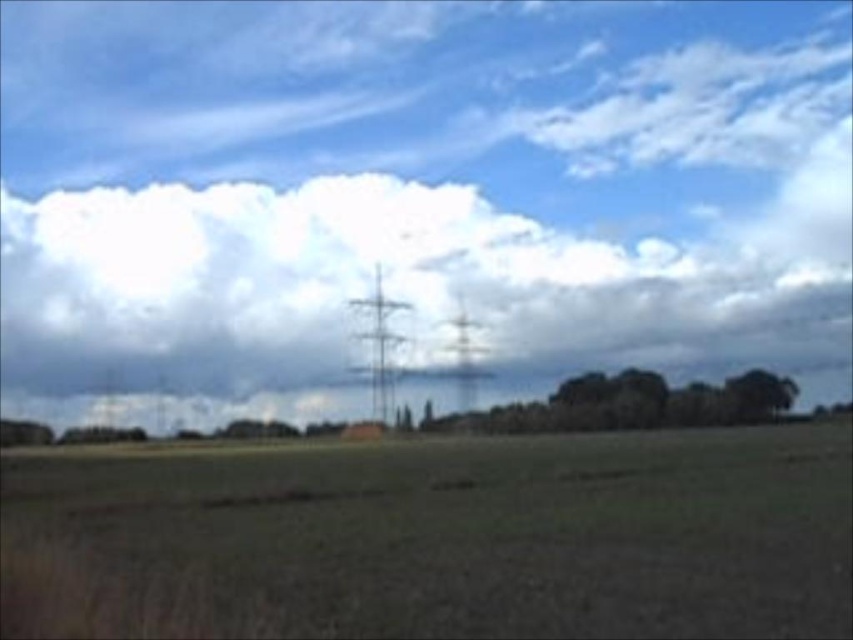
Question: Which point is farther to the camera?

Choices:
 (A) (753, 417)
 (B) (263, 326)

Answer: (B)

Question: Which point appears closest to the camera in this image?

Choices:
 (A) (637, 296)
 (B) (788, 378)
 (C) (515, 476)
 (D) (561, 403)

Answer: (C)

Question: Which point is closer to the camera?

Choices:
 (A) green leafy trees at center
 (B) white fluffy cloud at upper center
 (C) brown grassy field at center

Answer: (C)

Question: Is white fluffy cloud at upper center to the left of green leafy tree at lower right from the viewer's perspective?

Choices:
 (A) no
 (B) yes

Answer: (B)

Question: Is brown grassy field at center wider than green leafy trees at center?

Choices:
 (A) no
 (B) yes

Answer: (B)

Question: Does green leafy trees at center have a greater width compared to green leafy tree at lower right?

Choices:
 (A) no
 (B) yes

Answer: (B)